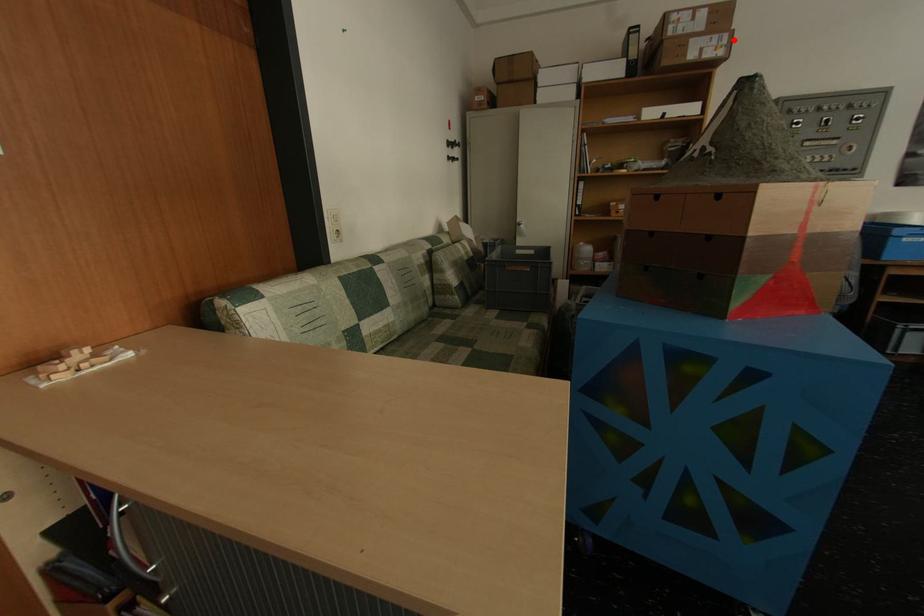
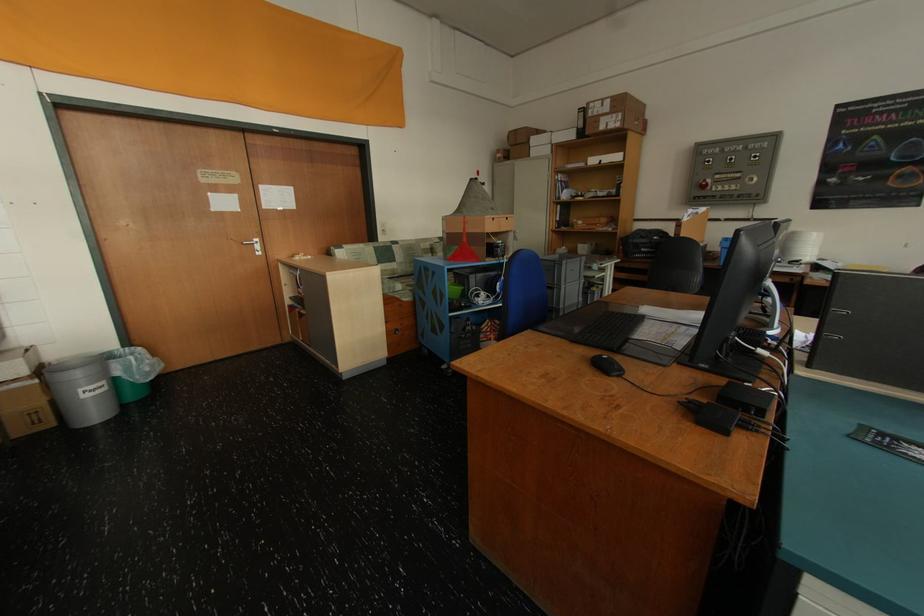
In the second image, find the point that corresponds to the highlighted location in the first image.

(628, 118)